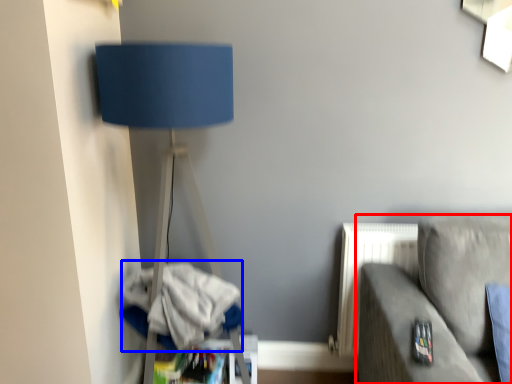
Question: Among these objects, which one is farthest to the camera, studio couch (highlighted by a red box) or laundry (highlighted by a blue box)?

Choices:
 (A) studio couch
 (B) laundry

Answer: (B)